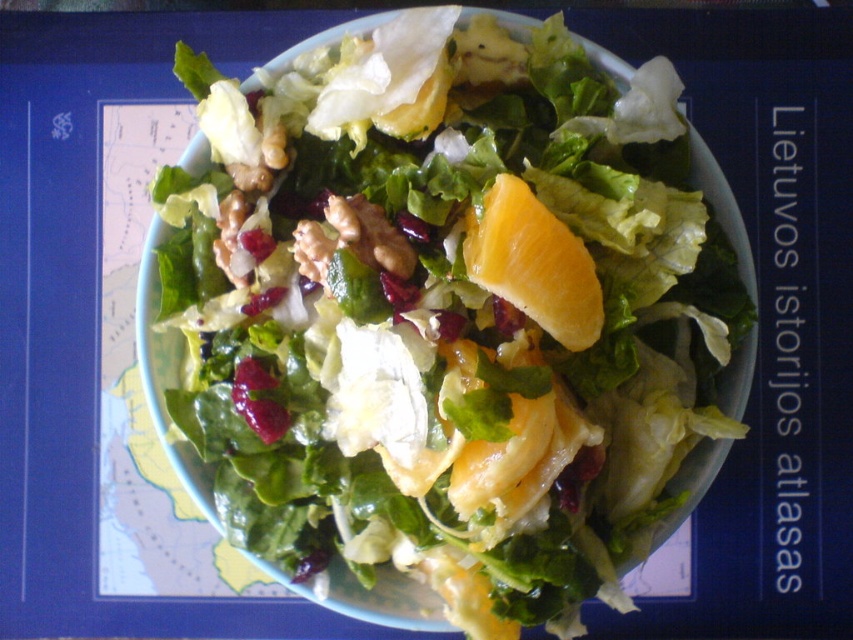
Question: Which of the following is the closest to the observer?

Choices:
 (A) (479, 221)
 (B) (318, 353)

Answer: (A)

Question: Does green leafy salad at center appear on the right side of orangesmoothfruit at center?

Choices:
 (A) no
 (B) yes

Answer: (A)

Question: Which object is closer to the camera taking this photo?

Choices:
 (A) orangesmoothfruit at center
 (B) green leafy salad at center

Answer: (A)

Question: Which point is farther from the camera taking this photo?

Choices:
 (A) (527, 310)
 (B) (457, 385)

Answer: (B)

Question: Is green leafy salad at center bigger than orangesmoothfruit at center?

Choices:
 (A) yes
 (B) no

Answer: (A)

Question: Can you confirm if green leafy salad at center is positioned below orangesmoothfruit at center?

Choices:
 (A) yes
 (B) no

Answer: (A)